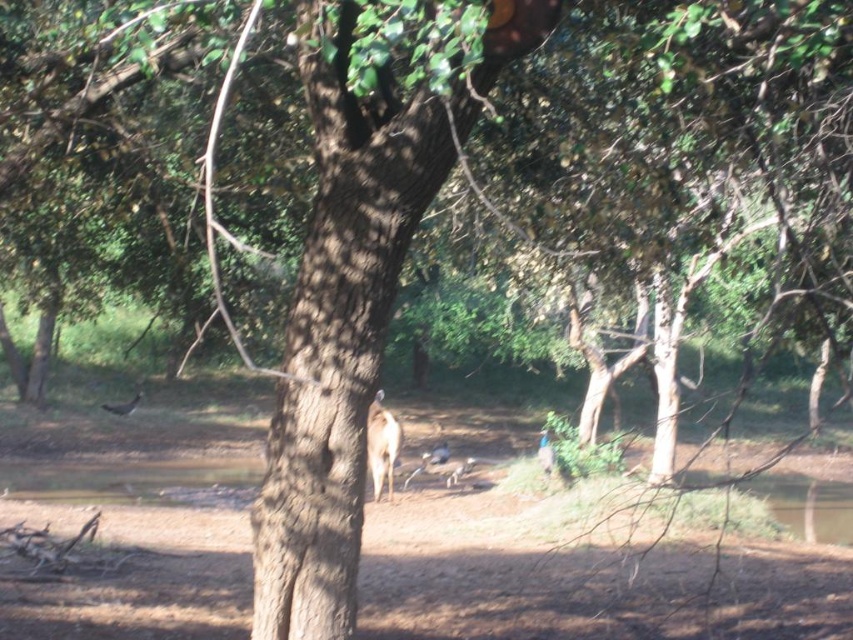
Question: Is brown rough tree trunk at center below brown furry deer at center?

Choices:
 (A) no
 (B) yes

Answer: (A)

Question: In this image, where is brown rough tree trunk at center located relative to brown furry deer at center?

Choices:
 (A) left
 (B) right

Answer: (B)

Question: Which is nearer to the brown fur antelope at center?

Choices:
 (A) brown feathered bird at lower left
 (B) brown rough tree trunk at center
 (C) brown furry deer at center

Answer: (C)

Question: Can you confirm if brown rough tree trunk at center is thinner than brown furry deer at center?

Choices:
 (A) no
 (B) yes

Answer: (A)

Question: Based on their relative distances, which object is nearer to the brown fur antelope at center?

Choices:
 (A) brown furry deer at center
 (B) brown furry animal at center

Answer: (B)

Question: Which of the following is the farthest from the observer?

Choices:
 (A) brown feathered bird at lower left
 (B) brown furry deer at center

Answer: (A)